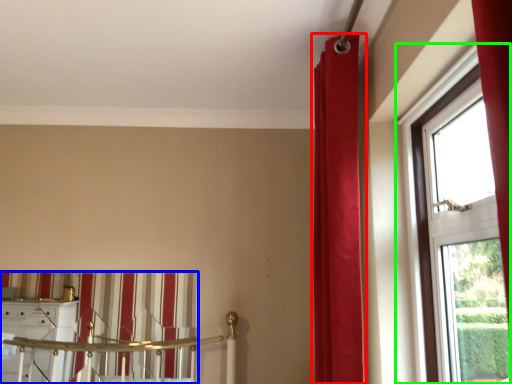
Question: Which object is the farthest from curtain (highlighted by a red box)? Choose among these: curtain (highlighted by a blue box) or window (highlighted by a green box).

Choices:
 (A) curtain
 (B) window

Answer: (A)